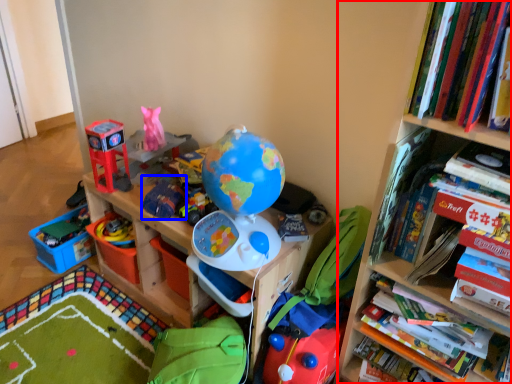
Question: Which point is closer to the camera, bookcase (highlighted by a red box) or toy (highlighted by a blue box)?

Choices:
 (A) bookcase
 (B) toy

Answer: (A)